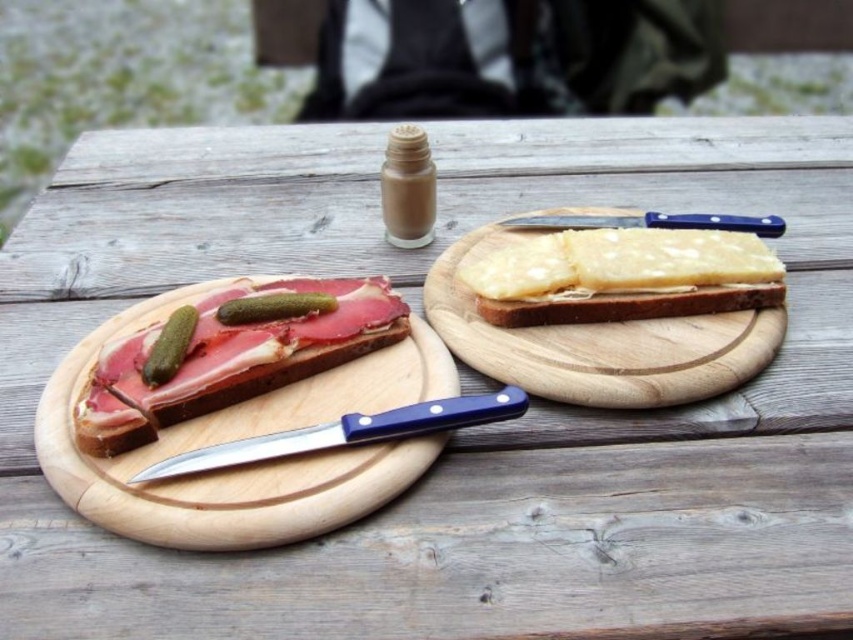
You are standing in front of the picnic table with the two cutting boards. You want to pick up the knife with the blue handle that is closer to you. Which of the two points, point (70, 374) or point (563, 224), should you reach for?

You should reach for point (70, 374) because it is closer to the viewer than point (563, 224), which means the knife at that point is nearer to you.